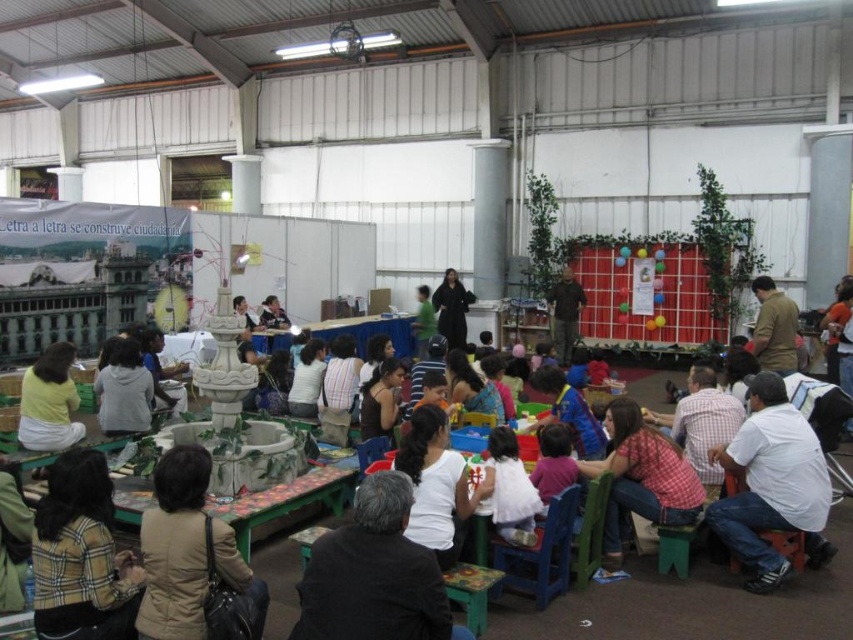
Which is more to the left, white cotton shirt at center or blue fabric shirt at center?

white cotton shirt at center

Is white cotton shirt at center above blue fabric shirt at center?

Incorrect, white cotton shirt at center is not positioned above blue fabric shirt at center.

Does point (525, 483) come closer to viewer compared to point (538, 422)?

Yes, point (525, 483) is in front of point (538, 422).

The image size is (853, 640). In order to click on white cotton shirt at center in this screenshot , I will do click(511, 490).

Which is above, brown cotton jacket at lower left or green fabric shirt at center?

Positioned higher is green fabric shirt at center.

Does brown cotton jacket at lower left have a lesser height compared to green fabric shirt at center?

Indeed, brown cotton jacket at lower left has a lesser height compared to green fabric shirt at center.

Where is `brown cotton jacket at lower left`? The height and width of the screenshot is (640, 853). brown cotton jacket at lower left is located at coordinates (175, 547).

Looking at this image, measure the distance between plaid fabric jacket at lower left and red plaid shirt at center.

plaid fabric jacket at lower left is 2.91 meters from red plaid shirt at center.

Who is more forward, (93, 580) or (635, 413)?

Point (93, 580)

Identify the location of plaid fabric jacket at lower left. click(x=80, y=556).